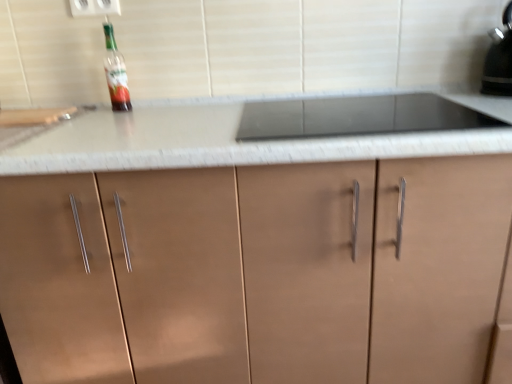
Find the location of `vacant area located to the right-hand side of translucent glass bottle at upper left`. vacant area located to the right-hand side of translucent glass bottle at upper left is located at coordinates (162, 109).